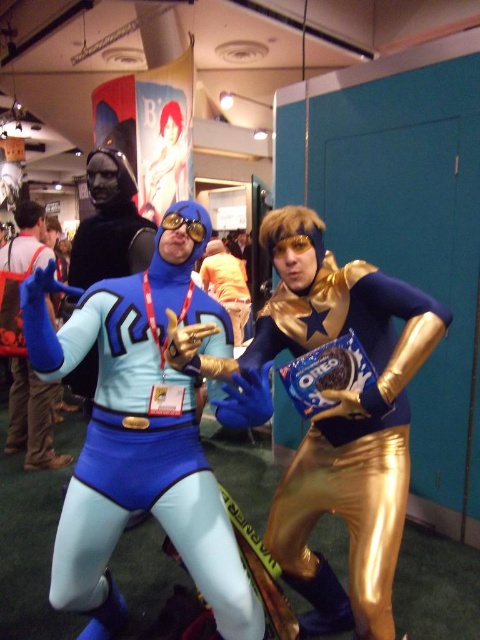
You are an attendee at the convention and want to take a photo of both the gold metallic pants at center and the matte blue suit at center. Since you can only focus on one object at a time, which one should you focus on to ensure the other is still in the background?

You should focus on the matte blue suit at center because the gold metallic pants at center is positioned under it, so focusing on the matte blue suit at center will keep the gold metallic pants at center in the background.

You are a photographer at the event and need to position two models wearing the matte blue spandex suit at center and the gold metallic pants at center for a photo. Since you want to ensure both fit comfortably in the frame, which model should you place closer to the camera to avoid crowding?

The matte blue spandex suit at center has a larger width than the gold metallic pants at center. To avoid crowding, place the matte blue spandex suit at center closer to the camera so it takes up more space in the frame while the narrower gold metallic pants at center can be positioned slightly farther back.

Looking at this image, you are standing at the entrance of the convention hall and want to take a photo of the point at coordinate point (26,316). Your camera has a focal length of 50mm and you are currently 2 meters away from the point. Should you move closer or farther away to focus properly?

The distance of point (26,316) from camera is 1.24 meters. Since you are currently 2 meters away, which is farther than the required distance, you should move closer to 1.24 meters to focus properly.